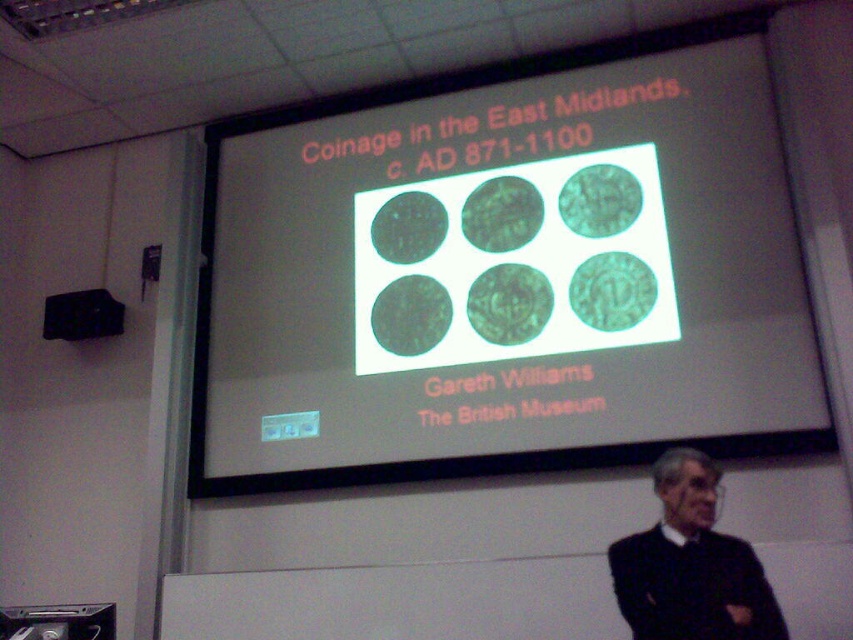
You are an attendee at the presentation and want to adjust your seat to face both the black fabric at lower right and the black plastic speaker at upper left. Based on their positions, which side should you sit on to have both in view?

You should sit on the right side of the room to have both the black fabric at lower right and the black plastic speaker at upper left in view since the black fabric at lower right is positioned to the right of the black plastic speaker at upper left.

You are sitting in the lecture hall and want to locate the black fabric at lower right and the black plastic speaker at upper left. Which object is positioned lower in the image?

The black fabric at lower right is positioned lower than the black plastic speaker at upper left.

You are sitting in the audience and want to adjust your seat to get a better view of the slide. Which object, the black fabric at lower right or the black plastic speaker at upper left, is closer to you?

The black fabric at lower right is closer to the viewer than the black plastic speaker at upper left.